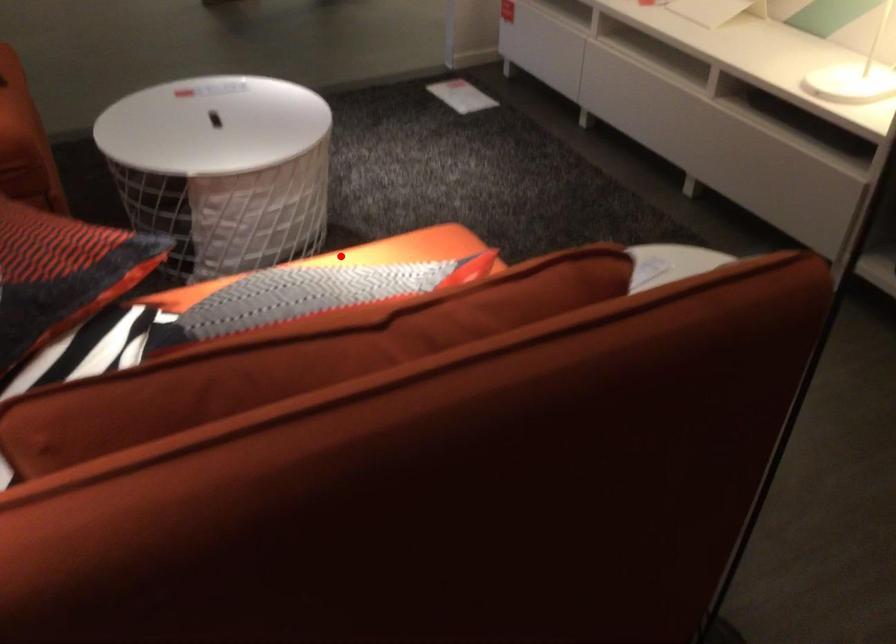
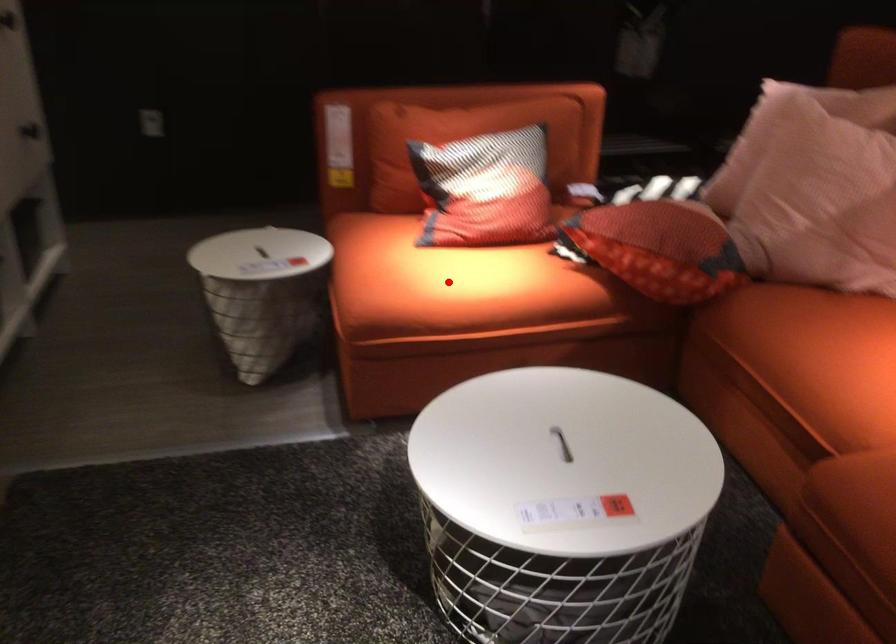
I am providing you with two images of the same scene from different viewpoints. A red point is marked on the first image and another point is marked on the second image. Do the highlighted points in image1 and image2 indicate the same real-world spot?

Yes